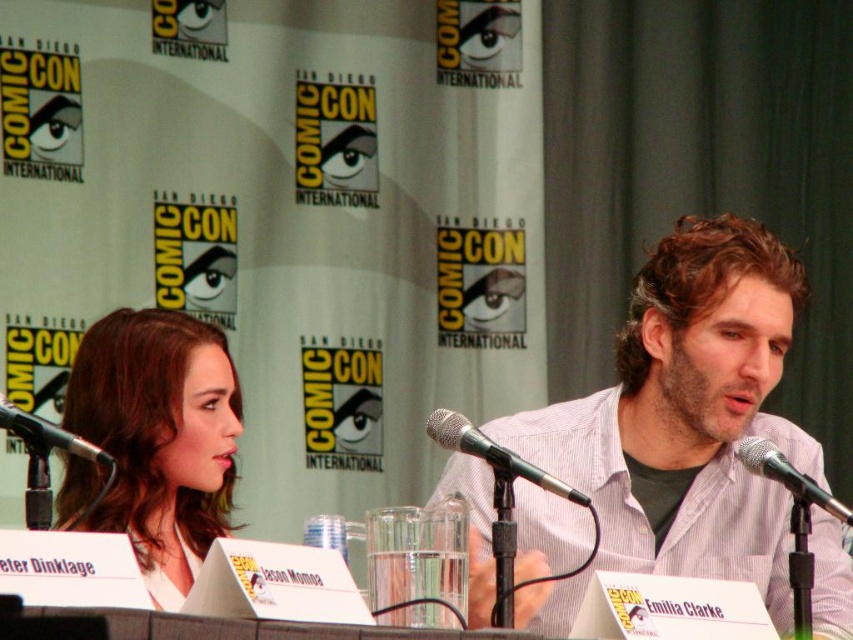
Question: Which of these objects is positioned farthest from the black metallic microphone at center?

Choices:
 (A) black metallic microphone at left
 (B) metallic silver microphone at center

Answer: (A)

Question: Can you confirm if smooth brown hair at center is positioned to the right of metallic silver microphone at center?

Choices:
 (A) yes
 (B) no

Answer: (B)

Question: Which object is farther from the camera taking this photo?

Choices:
 (A) black metallic microphone at left
 (B) black metallic microphone at center

Answer: (B)

Question: Does black metallic microphone at center appear on the right side of black metallic microphone at left?

Choices:
 (A) yes
 (B) no

Answer: (A)

Question: Is gray striped shirt at center below metallic silver microphone at center?

Choices:
 (A) no
 (B) yes

Answer: (B)

Question: Which of the following is the closest to the observer?

Choices:
 (A) smooth brown hair at center
 (B) black metallic microphone at center
 (C) metallic silver microphone at center
 (D) gray striped shirt at center

Answer: (B)